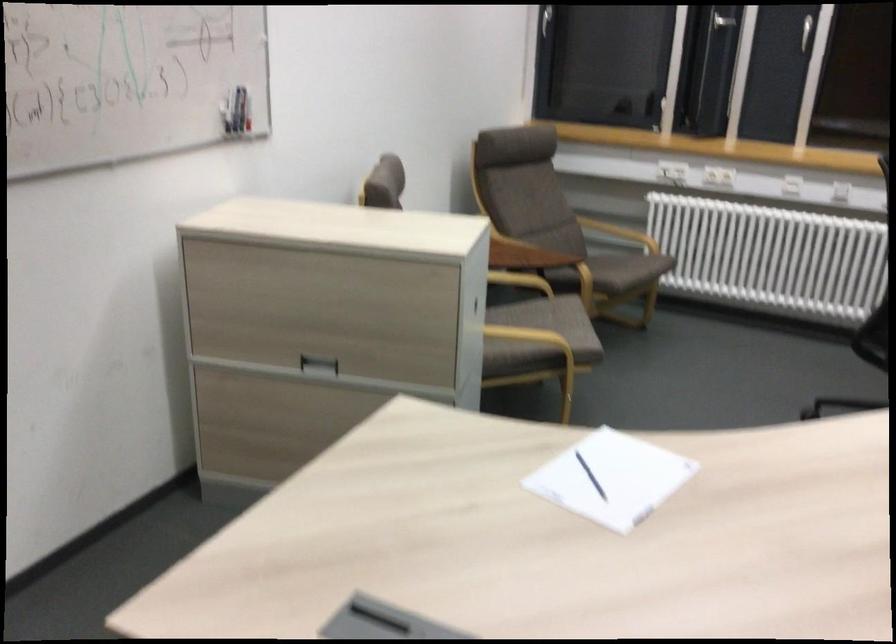
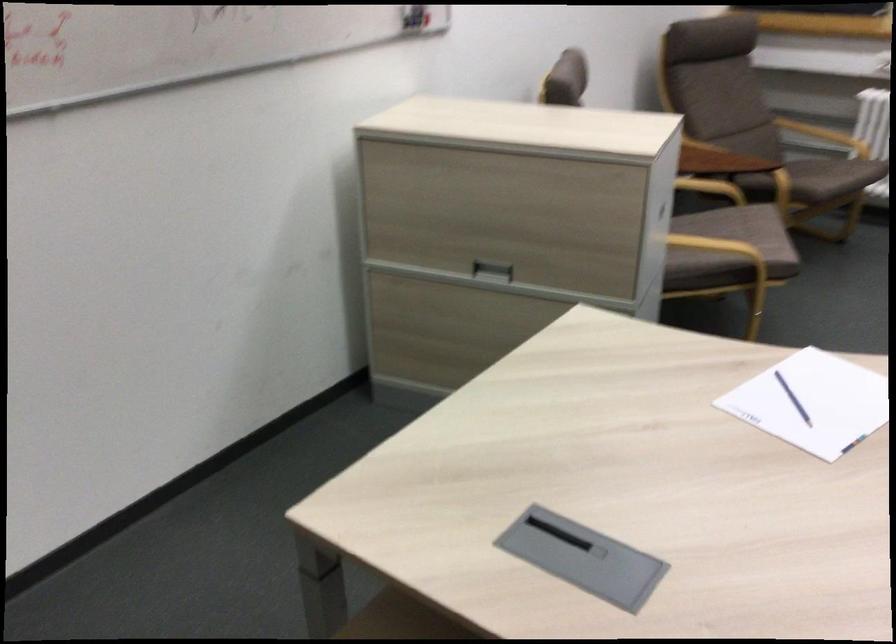
Where in the second image is the point corresponding to (622,232) from the first image?

(824, 136)